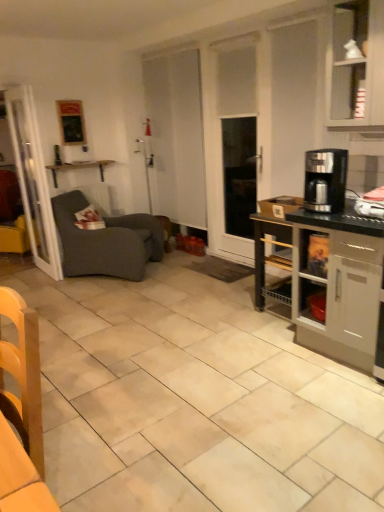
Locate an element on the screen. vacant space to the left of black glossy coffee maker at right is located at coordinates (265, 354).